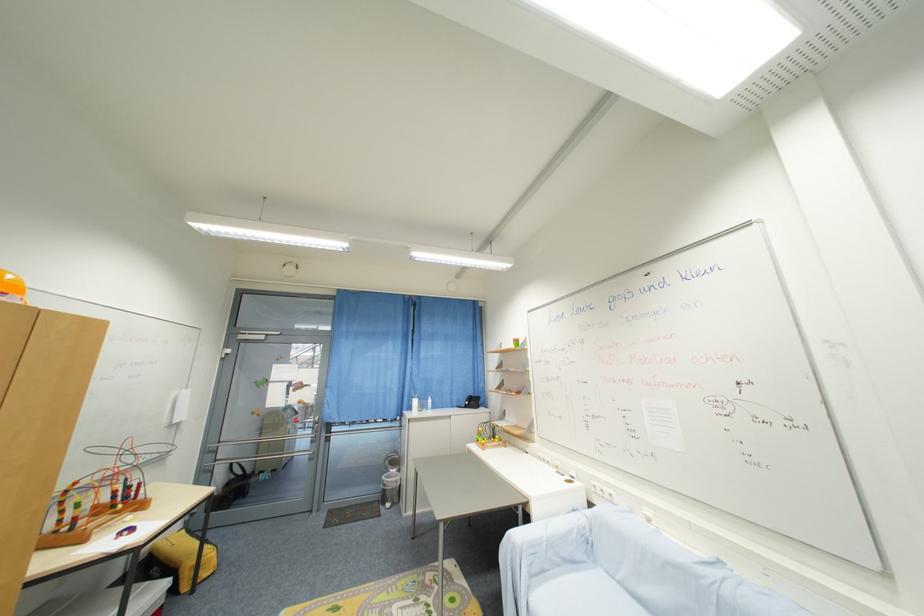
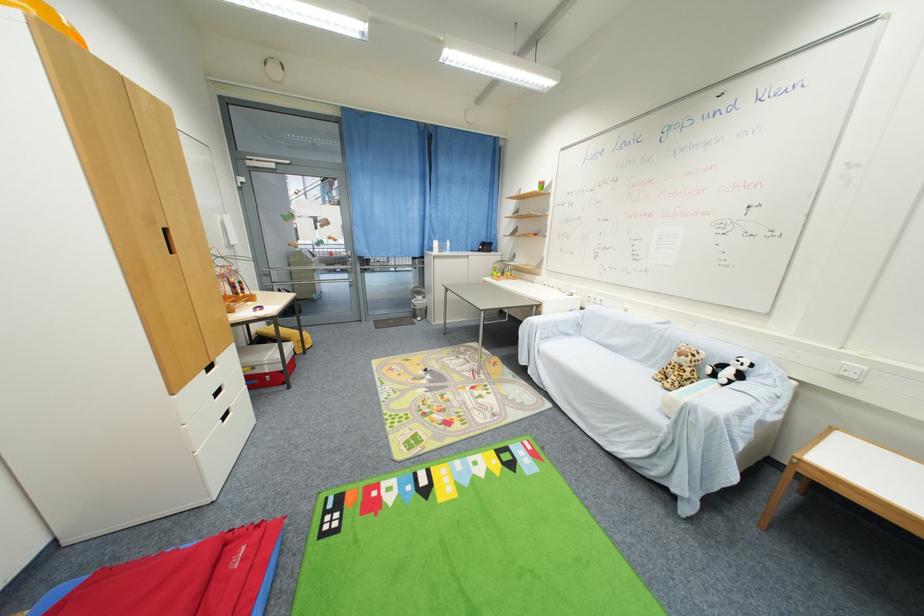
Question: How did the camera likely rotate?

Choices:
 (A) Left
 (B) Right
 (C) Up
 (D) Down

Answer: (D)